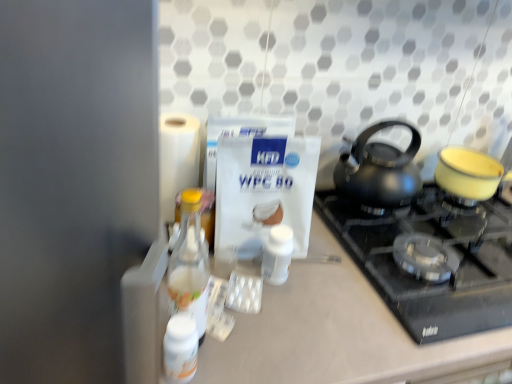
Question: From a real-world perspective, is black glass gas stove at center positioned above or below clear glass bottle at left, the first bottle from the front?

Choices:
 (A) above
 (B) below

Answer: (B)

Question: In the image, is black glass gas stove at center positioned in front of or behind clear glass bottle at left, the first bottle from the front?

Choices:
 (A) behind
 (B) front

Answer: (A)

Question: Which object is the farthest from the black matte kettle at upper right?

Choices:
 (A) white glossy bottle at lower left, the first bottle from the left
 (B) black glass gas stove at center
 (C) yellow matte pot at upper right
 (D) clear glass bottle at left, the second bottle in the right-to-left sequence
 (E) white matte counter at center

Answer: (A)

Question: Which object is positioned farthest from the clear glass bottle at left, marked as the 2th bottle in a left-to-right arrangement?

Choices:
 (A) white matte counter at center
 (B) black glass gas stove at center
 (C) white matte bottle at center, which is the 1th bottle from right to left
 (D) yellow matte pot at upper right
 (E) white glossy bottle at lower left, which ranks as the 2th bottle in back-to-front order

Answer: (D)